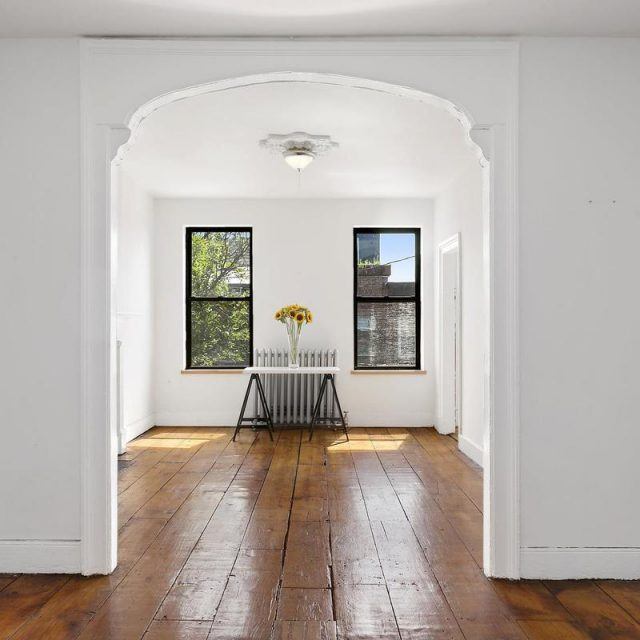
Locate an element on the screen. doorframe is located at coordinates (499, 477), (100, 451).